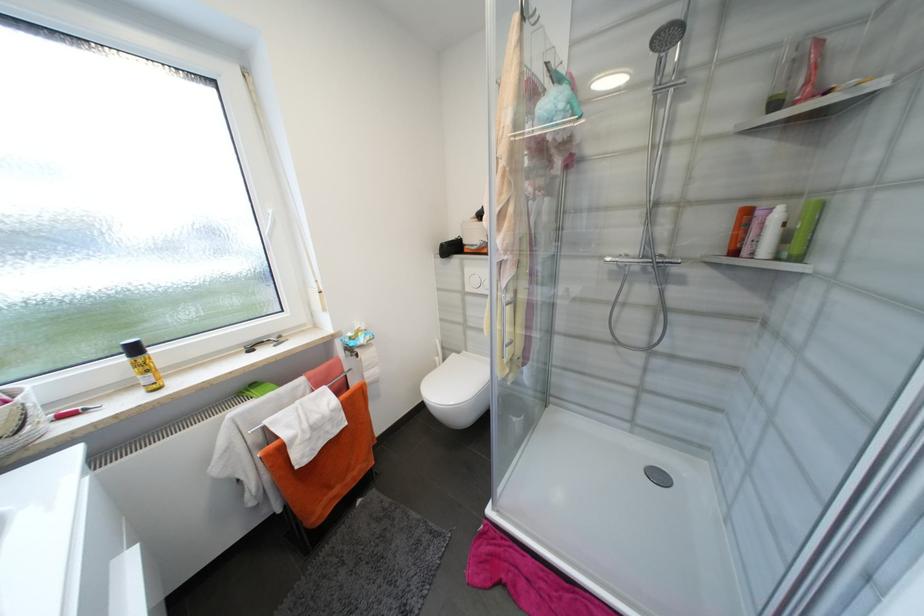
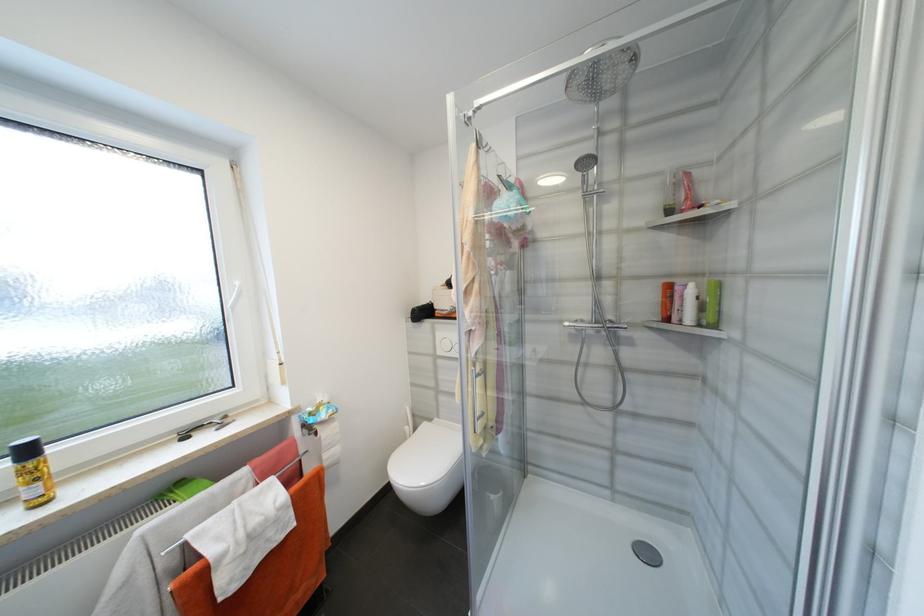
Where in the second image is the point corresponding to (x=769, y=225) from the first image?

(687, 297)